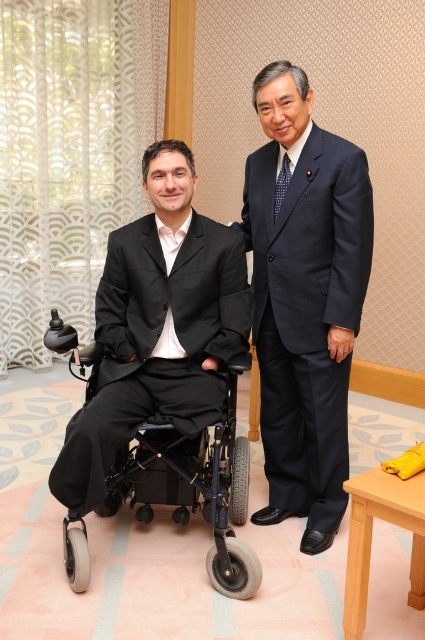
You are a fashion designer analyzing the positioning of clothing items in the image. Given the coordinates provided for the dark blue suit at center, can you determine its spatial relationship to the other objects in the scene?

The dark blue suit at center is located at point [305,298], which places it centrally in the image, likely positioned between the seated individual in the wheelchair and the background elements.

Based on the coordinates provided, which object is located at point (305, 298) in the scene?

The point (305, 298) corresponds to the dark blue suit at center.

In the scene shown: You are a photographer setting up for a group photo. You have two subjects in front of you, the dark blue suit at center and the black plastic wheelchair at left. You need to position them so that they are exactly 2 feet apart. Based on their current positions, do you need to move them closer or farther apart?

The current distance between the dark blue suit at center and the black plastic wheelchair at left is 16.69 inches. Since 2 feet equals 24 inches, you need to move them farther apart to reach the required distance.